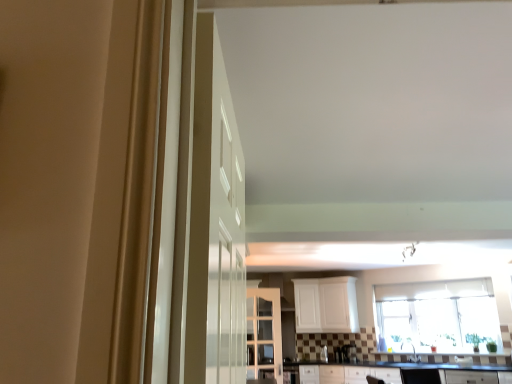
Based on the photo, measure the distance between white glossy door at center and camera.

white glossy door at center is 26.20 inches away from camera.

I want to click on white glossy door at center, so click(225, 231).

Measure the distance between black laminate countertop at lower center and camera.

The distance of black laminate countertop at lower center from camera is 18.22 feet.

What is the approximate width of white matte cabinet at center, which is the first cabinetry in back-to-front order?

It is 25.34 inches.

Identify the location of white glossy door at center. (225, 231).

Considering the sizes of objects white glossy cabinet at center, which is counted as the 2th cabinetry, starting from the right, and white matte cabinet at center, the second cabinetry viewed from the front, in the image provided, who is bigger, white glossy cabinet at center, which is counted as the 2th cabinetry, starting from the right, or white matte cabinet at center, the second cabinetry viewed from the front,?

With larger size is white matte cabinet at center, the second cabinetry viewed from the front.

Which object is positioned more to the right, white glossy cabinet at center, positioned as the 2th cabinetry in back-to-front order, or white matte cabinet at center, the second cabinetry viewed from the front?

From the viewer's perspective, white matte cabinet at center, the second cabinetry viewed from the front, appears more on the right side.

Where is `cabinetry positioned vertically above the white glossy cabinet at center, acting as the 1th cabinetry starting from the front (from a real-world perspective)`? cabinetry positioned vertically above the white glossy cabinet at center, acting as the 1th cabinetry starting from the front (from a real-world perspective) is located at coordinates (326, 305).

In terms of width, does white glossy cabinet at center, acting as the 1th cabinetry starting from the front, look wider or thinner when compared to white matte cabinet at center, marked as the first cabinetry in a right-to-left arrangement?

Considering their sizes, white glossy cabinet at center, acting as the 1th cabinetry starting from the front, looks slimmer than white matte cabinet at center, marked as the first cabinetry in a right-to-left arrangement.

From a real-world perspective, which object rests below the other?

In real-world perspective, black laminate countertop at lower center is lower.

Looking at this image, is black laminate countertop at lower center not within white glossy sink at center?

That's correct, black laminate countertop at lower center is outside of white glossy sink at center.

Is black laminate countertop at lower center smaller than white glossy sink at center?

No, black laminate countertop at lower center is not smaller than white glossy sink at center.

Is black laminate countertop at lower center turned away from white glossy sink at center?

black laminate countertop at lower center does not have its back to white glossy sink at center.

Is white glossy cabinet at center, positioned as the first cabinetry in left-to-right order, not near white glossy sink at center?

Yes, white glossy cabinet at center, positioned as the first cabinetry in left-to-right order, and white glossy sink at center are quite far apart.

Choose the correct answer: Is white glossy cabinet at center, acting as the 1th cabinetry starting from the front, inside white glossy sink at center or outside it?

The correct answer is: outside.

Is the position of white glossy cabinet at center, positioned as the first cabinetry in left-to-right order, more distant than that of white glossy sink at center?

No, it is not.

Visually, is white glossy cabinet at center, which is counted as the 2th cabinetry, starting from the right, positioned to the left or to the right of white glossy sink at center?

Based on their positions, white glossy cabinet at center, which is counted as the 2th cabinetry, starting from the right, is located to the left of white glossy sink at center.

Considering the relative positions of white matte cabinet at center, the second cabinetry viewed from the front, and white glossy door at center in the image provided, is white matte cabinet at center, the second cabinetry viewed from the front, to the right of white glossy door at center from the viewer's perspective?

Yes.

Does point (351, 288) come in front of point (226, 210)?

No, (351, 288) is further to viewer.

Is white matte cabinet at center, marked as the first cabinetry in a right-to-left arrangement, not close to white glossy door at center?

Indeed, white matte cabinet at center, marked as the first cabinetry in a right-to-left arrangement, is not near white glossy door at center.

From a real-world perspective, is white matte cabinet at center, marked as the first cabinetry in a right-to-left arrangement, over white glossy door at center?

Yes, from a real-world perspective, white matte cabinet at center, marked as the first cabinetry in a right-to-left arrangement, is over white glossy door at center

Is black laminate countertop at lower center inside the boundaries of white glossy cabinet at center, positioned as the first cabinetry in left-to-right order, or outside?

black laminate countertop at lower center is not enclosed by white glossy cabinet at center, positioned as the first cabinetry in left-to-right order.

Is white glossy cabinet at center, acting as the 1th cabinetry starting from the front, at the back of black laminate countertop at lower center?

That's not correct — black laminate countertop at lower center is not looking away from white glossy cabinet at center, acting as the 1th cabinetry starting from the front.

Consider the image. Would you say black laminate countertop at lower center is to the left or to the right of white glossy cabinet at center, which is counted as the 2th cabinetry, starting from the right, in the picture?

Clearly, black laminate countertop at lower center is on the right of white glossy cabinet at center, which is counted as the 2th cabinetry, starting from the right, in the image.

Does black laminate countertop at lower center have a greater height compared to white glossy cabinet at center, which is counted as the 2th cabinetry, starting from the right?

Incorrect, the height of black laminate countertop at lower center is not larger of that of white glossy cabinet at center, which is counted as the 2th cabinetry, starting from the right.

Is black laminate countertop at lower center positioned beyond the bounds of white glossy door at center?

black laminate countertop at lower center is positioned outside white glossy door at center.

Looking at this image, considering the relative sizes of black laminate countertop at lower center and white glossy door at center in the image provided, is black laminate countertop at lower center bigger than white glossy door at center?

Yes, black laminate countertop at lower center is bigger than white glossy door at center.

Is black laminate countertop at lower center wider or thinner than white glossy door at center?

Clearly, black laminate countertop at lower center has more width compared to white glossy door at center.

Considering their positions, is black laminate countertop at lower center located in front of or behind white glossy door at center?

black laminate countertop at lower center is behind white glossy door at center.

Is white glossy sink at center inside the boundaries of clear glass window at center, or outside?

white glossy sink at center exists outside the volume of clear glass window at center.

From a real-world perspective, does white glossy sink at center sit lower than clear glass window at center?

Correct, in the physical world, white glossy sink at center is lower than clear glass window at center.

Consider the image. Can you confirm if white glossy sink at center is taller than clear glass window at center?

No, white glossy sink at center is not taller than clear glass window at center.

Identify the location of cabinetry below the white matte cabinet at center, which is counted as the 2th cabinetry, starting from the left (from the image's perspective). (264, 335).

Find the location of a particular element. This screenshot has height=384, width=512. countertop directly beneath the white glossy sink at center (from a real-world perspective) is located at coordinates (394, 371).

Based on their spatial positions, is clear glass window at center or black laminate countertop at lower center closer to white glossy cabinet at center, acting as the 1th cabinetry starting from the front?

black laminate countertop at lower center is closer to white glossy cabinet at center, acting as the 1th cabinetry starting from the front.

When comparing their distances from clear glass window at center, does white glossy cabinet at center, which is counted as the 2th cabinetry, starting from the right, or white matte cabinet at center, marked as the first cabinetry in a right-to-left arrangement, seem closer?

white matte cabinet at center, marked as the first cabinetry in a right-to-left arrangement, lies closer to clear glass window at center than the other object.

Which object lies further to the anchor point white glossy cabinet at center, positioned as the 2th cabinetry in back-to-front order, black laminate countertop at lower center or white glossy door at center?

Among the two, white glossy door at center is located further to white glossy cabinet at center, positioned as the 2th cabinetry in back-to-front order.

Which object lies further to the anchor point white glossy cabinet at center, which is counted as the 2th cabinetry, starting from the right, clear glass window at center or white matte cabinet at center, which is counted as the 2th cabinetry, starting from the left?

clear glass window at center is further to white glossy cabinet at center, which is counted as the 2th cabinetry, starting from the right.

When comparing their distances from clear glass window at center, does white glossy cabinet at center, positioned as the first cabinetry in left-to-right order, or black laminate countertop at lower center seem closer?

Based on the image, black laminate countertop at lower center appears to be nearer to clear glass window at center.

Which object lies nearer to the anchor point clear glass window at center, white glossy cabinet at center, positioned as the first cabinetry in left-to-right order, or white glossy sink at center?

white glossy sink at center is closer to clear glass window at center.

From the picture: Estimate the real-world distances between objects in this image. Which object is further from white glossy door at center, clear glass window at center or black laminate countertop at lower center?

clear glass window at center.

When comparing their distances from white glossy door at center, does clear glass window at center or white matte cabinet at center, the second cabinetry viewed from the front, seem further?

The object further to white glossy door at center is clear glass window at center.

Where is `countertop positioned between white glossy door at center and white glossy cabinet at center, which is counted as the 2th cabinetry, starting from the right, from near to far`? This screenshot has height=384, width=512. countertop positioned between white glossy door at center and white glossy cabinet at center, which is counted as the 2th cabinetry, starting from the right, from near to far is located at coordinates (394, 371).

Image resolution: width=512 pixels, height=384 pixels. Find the location of `cabinetry between white glossy cabinet at center, positioned as the first cabinetry in left-to-right order, and clear glass window at center from left to right`. cabinetry between white glossy cabinet at center, positioned as the first cabinetry in left-to-right order, and clear glass window at center from left to right is located at coordinates (326, 305).

Locate an element on the screen. countertop located between white glossy door at center and white glossy sink at center in the depth direction is located at coordinates tap(394, 371).

Find the location of a particular element. The image size is (512, 384). countertop between white glossy door at center and clear glass window at center from front to back is located at coordinates (394, 371).